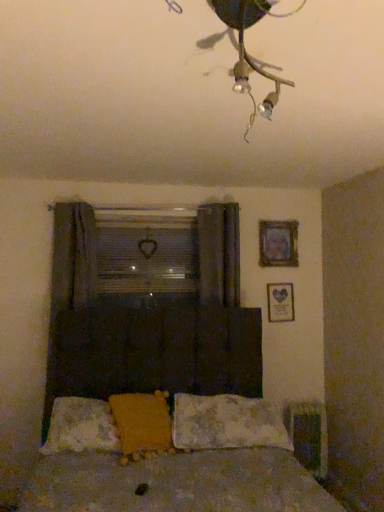
This screenshot has height=512, width=384. I want to click on free space above metallic wire at upper center (from a real-world perspective), so click(x=276, y=29).